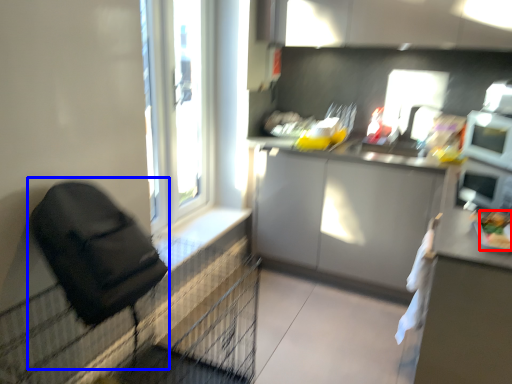
Question: Which object appears farthest to the camera in this image, food (highlighted by a red box) or feeding chair (highlighted by a blue box)?

Choices:
 (A) food
 (B) feeding chair

Answer: (A)